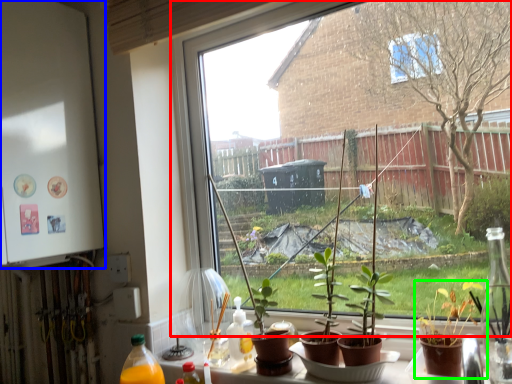
Question: Which object is the farthest from window (highlighted by a red box)? Choose among these: back (highlighted by a blue box) or houseplant (highlighted by a green box).

Choices:
 (A) back
 (B) houseplant

Answer: (B)